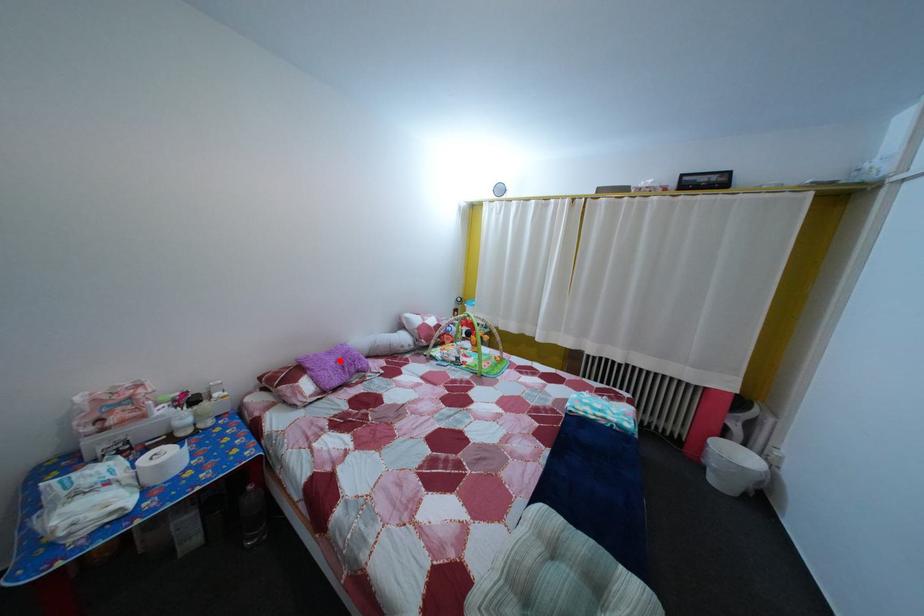
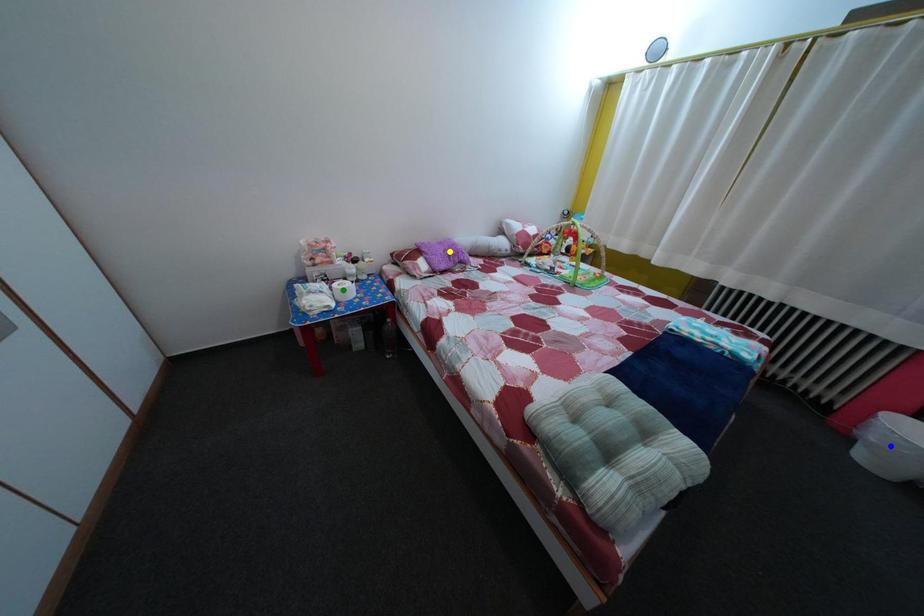
Question: I am providing you with two images of the same scene from different viewpoints. A red point is marked on the first image. You are given multiple points on the second image. Which spot in image 2 lines up with the point in image 1?

Choices:
 (A) green point
 (B) blue point
 (C) yellow point

Answer: (C)